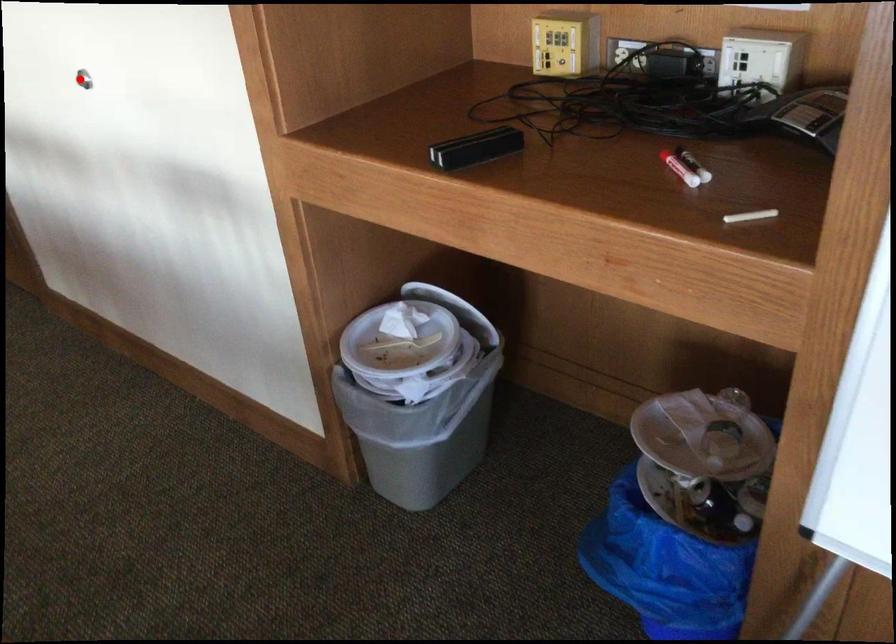
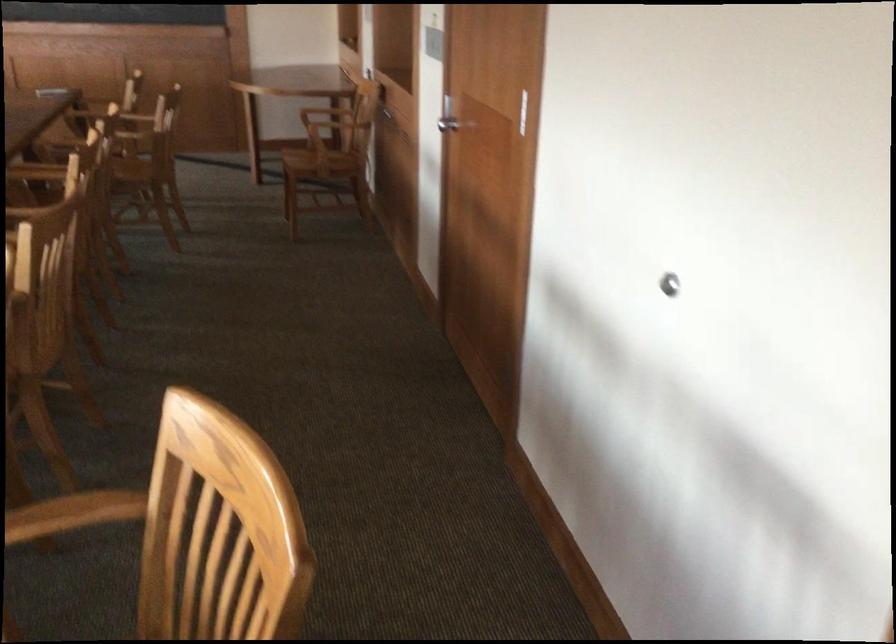
Find the pixel in the second image that matches the highlighted location in the first image.

(669, 283)